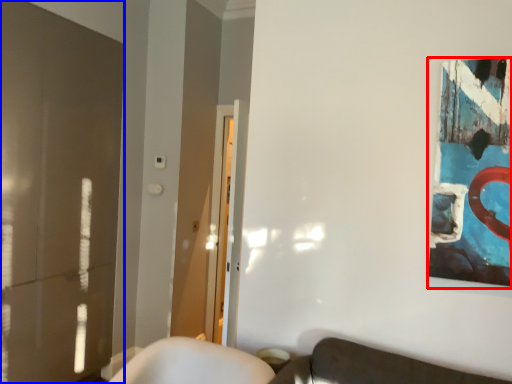
Question: Which object is further to the camera taking this photo, picture frame (highlighted by a red box) or glass door (highlighted by a blue box)?

Choices:
 (A) picture frame
 (B) glass door

Answer: (B)